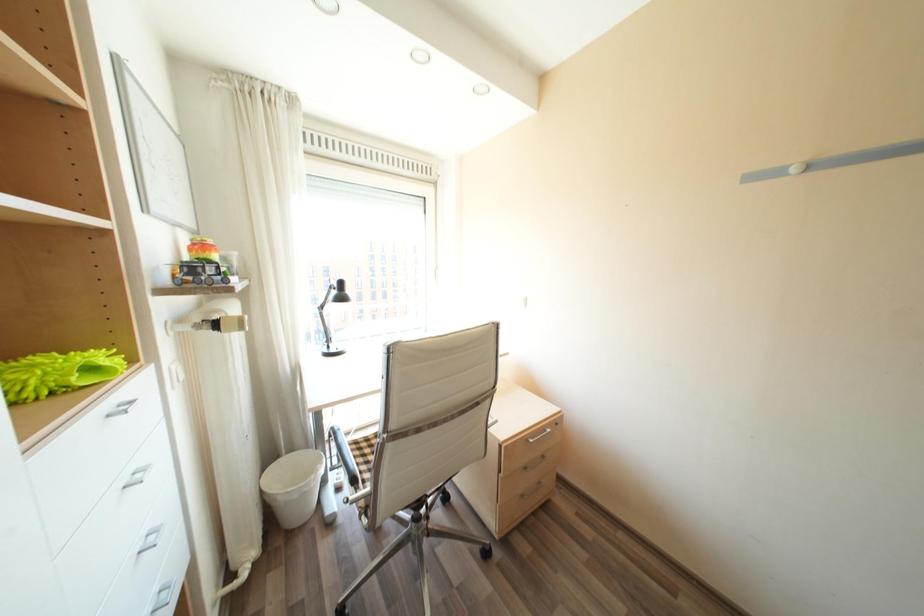
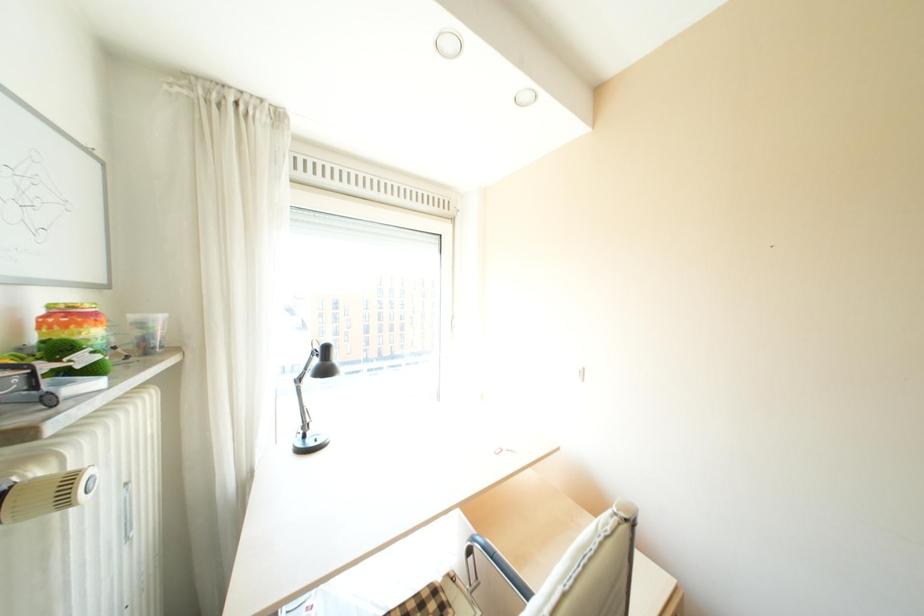
Question: The images are taken continuously from a first-person perspective. In which direction are you moving?

Choices:
 (A) Left
 (B) Right
 (C) Forward
 (D) Backward

Answer: (C)